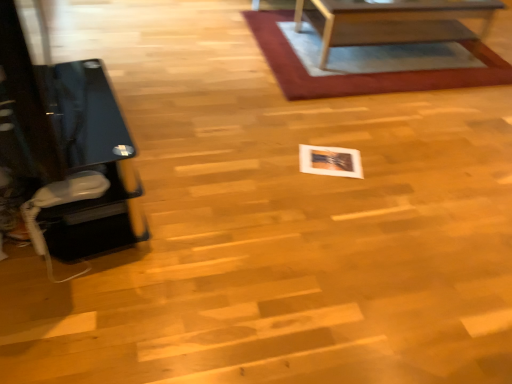
Question: From the image's perspective, relative to rug with woven texture at upper center, is wooden table at upper center above or below?

Choices:
 (A) below
 (B) above

Answer: (B)

Question: Is wooden table at upper center spatially inside rug with woven texture at upper center, or outside of it?

Choices:
 (A) inside
 (B) outside

Answer: (B)

Question: Which object is the closest to the rug with woven texture at upper center?

Choices:
 (A) white glossy photo frame at center
 (B) wooden table at upper center
 (C) black glass table at left

Answer: (B)

Question: Which object is positioned closest to the wooden table at upper center?

Choices:
 (A) white glossy photo frame at center
 (B) black glass table at left
 (C) rug with woven texture at upper center

Answer: (C)